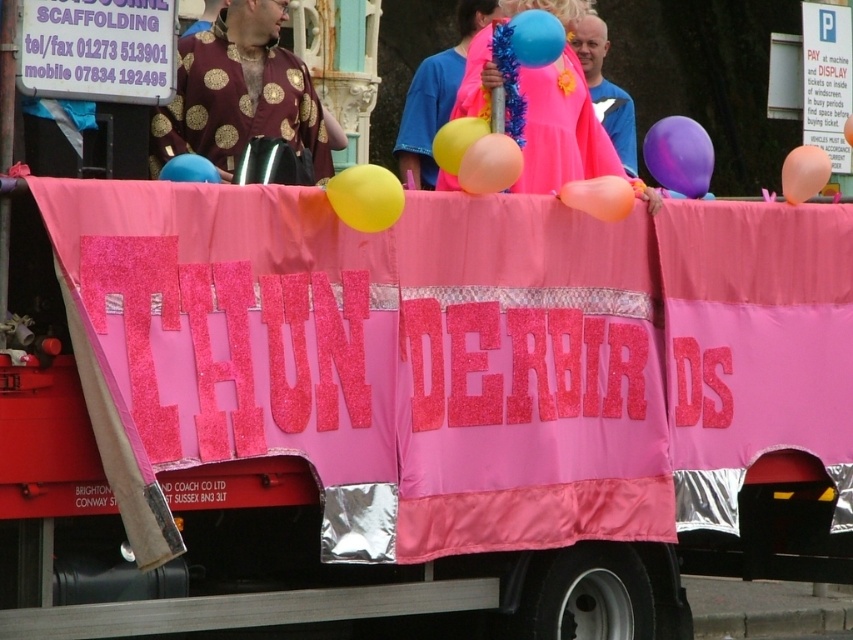
Measure the distance between point (584, 33) and camera.

The distance of point (584, 33) from camera is 21.25 meters.

Can you confirm if blue shiny balloon at upper center is taller than glossy yellow balloon at center?

Indeed, blue shiny balloon at upper center has a greater height compared to glossy yellow balloon at center.

Between point (621, 148) and point (451, 131), which one is positioned behind?

The point (621, 148) is more distant.

Identify the location of blue shiny balloon at upper center. (605, 88).

Describe the element at coordinates (241, 93) in the screenshot. I see `maroon velvet robe at upper center` at that location.

Is maroon velvet robe at upper center wider than neon pink fabric at upper center?

Incorrect, maroon velvet robe at upper center's width does not surpass neon pink fabric at upper center's.

Is point (312, 180) closer to camera compared to point (404, 128)?

Yes, it is.

Find the location of a particular element. maroon velvet robe at upper center is located at coordinates (241, 93).

Is point (300, 116) more distant than point (566, 182)?

Yes, point (300, 116) is farther from viewer.

Is maroon velvet robe at upper center closer to camera compared to translucent orange balloon at center?

That is False.

Is point (248, 17) closer to viewer compared to point (633, 189)?

No, it is not.

I want to click on maroon velvet robe at upper center, so click(x=241, y=93).